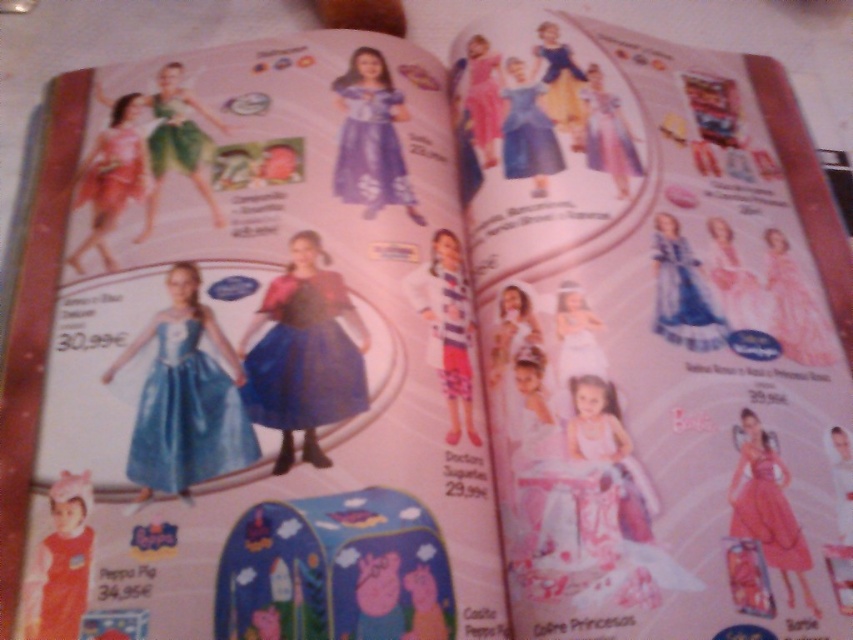
Question: Is matte blue dress at center bigger than pink satin dress at upper left?

Choices:
 (A) no
 (B) yes

Answer: (B)

Question: Estimate the real-world distances between objects in this image. Which object is farther from the green satin dress at upper left?

Choices:
 (A) matte blue dress at center
 (B) matte blue dress at upper center

Answer: (B)

Question: Which of the following is the closest to the observer?

Choices:
 (A) matte pink dress at upper right
 (B) white matte dress at center
 (C) purple satin dress at center
 (D) matte blue dress at center

Answer: (D)

Question: Considering the real-world distances, which object is closest to the pink satin dress at lower right?

Choices:
 (A) purple satin dress at center
 (B) pink satin dress at upper right
 (C) pink satin dress at upper center
 (D) matte blue dress at center

Answer: (B)

Question: Can you confirm if pink satin dress at upper left is bigger than matte blue dress at upper center?

Choices:
 (A) yes
 (B) no

Answer: (A)

Question: Does blue satin dress at upper right appear over pink satin dress at upper right?

Choices:
 (A) yes
 (B) no

Answer: (A)